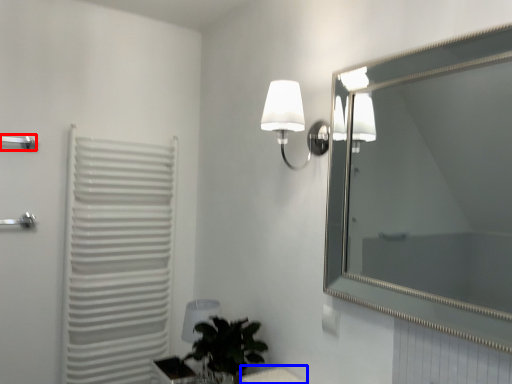
Question: Which point is further to the camera, towel bar (highlighted by a red box) or table (highlighted by a blue box)?

Choices:
 (A) towel bar
 (B) table

Answer: (A)